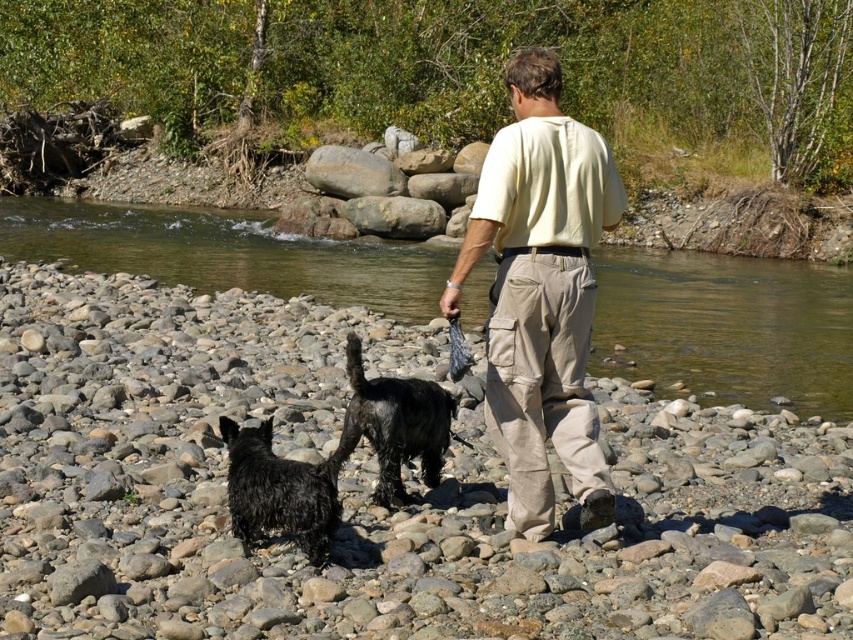
Based on the scene description, which object is taller between the smooth pebbles at center and the beige cotton shirt at center?

The smooth pebbles at center are taller than the beige cotton shirt at center according to the description.

You are a hiker who wants to cross the river using the shallowest part. The clear water at river center and the shiny black fur at center are visible from your vantage point. Which area should you choose to cross safely?

The clear water at river center has a larger size compared to shiny black fur at center, so the clear water at river center is deeper. Therefore, the shiny black fur at center is the safer option for crossing since it is shallower.

You are a hiker who wants to cross the river using the smooth pebbles at center and the beige cotton shirt at center. Which object is larger in size and can provide a more stable footing for crossing?

The smooth pebbles at center are larger in size than the beige cotton shirt at center, so they can provide a more stable footing for crossing.